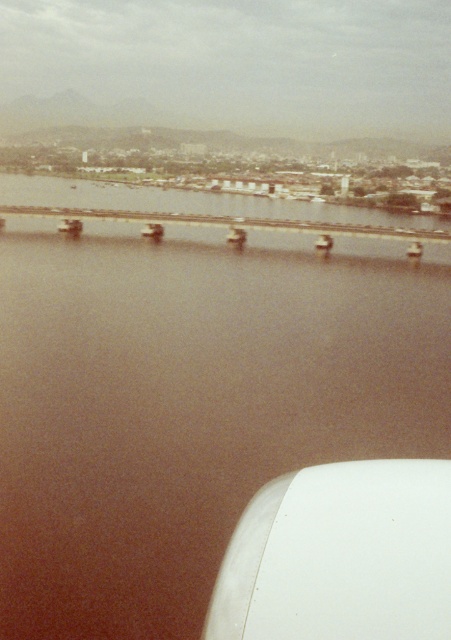
Is brown water at center taller than concrete bridge at center?

Yes, brown water at center is taller than concrete bridge at center.

Is brown water at center smaller than concrete bridge at center?

No.

Which is in front, point (197, 275) or point (115, 225)?

Point (197, 275) is in front.

You are a GUI agent. You are given a task and a screenshot of the screen. Output one action in this format:
    pyautogui.click(x=<x>, y=<y>)
    Task: Click on the brown water at center
    Image resolution: width=451 pixels, height=640 pixels.
    Given the screenshot: What is the action you would take?
    pyautogui.click(x=189, y=403)